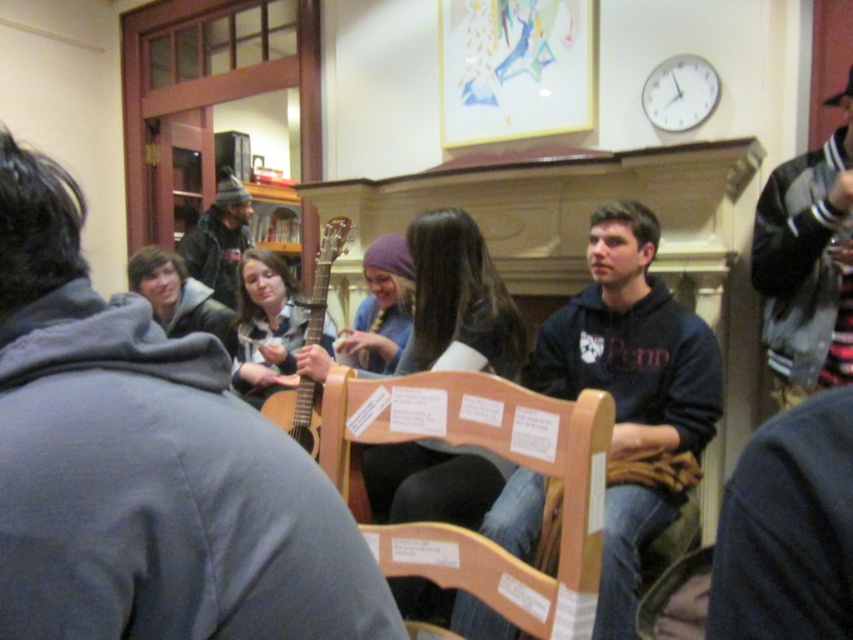
Question: Which point is farther to the camera?

Choices:
 (A) matte black guitar at center
 (B) striped knit sweater at right
 (C) dark blue hoodie at center
 (D) dark gray knit hat at upper left

Answer: (D)

Question: Does matte black guitar at center have a smaller size compared to striped knit sweater at right?

Choices:
 (A) yes
 (B) no

Answer: (A)

Question: Can you confirm if striped knit sweater at right is thinner than matte brown guitar at center?

Choices:
 (A) yes
 (B) no

Answer: (A)

Question: Considering the real-world distances, which object is closest to the matte black guitar at center?

Choices:
 (A) wooden chair at center
 (B) dark gray knit hat at upper left
 (C) striped knit sweater at right

Answer: (A)

Question: Is dark blue hoodie at center further to camera compared to striped knit sweater at right?

Choices:
 (A) no
 (B) yes

Answer: (A)

Question: Which point appears closest to the camera in this image?

Choices:
 (A) (611, 250)
 (B) (850, 70)

Answer: (A)